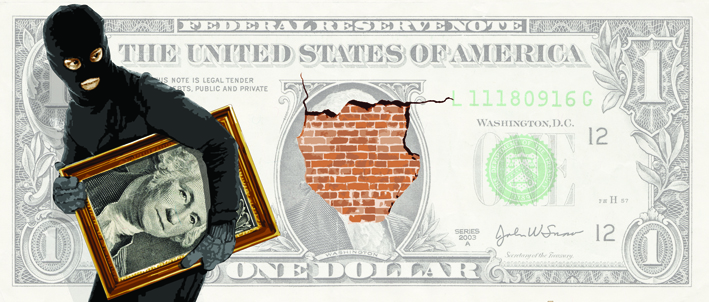
This screenshot has width=709, height=302. I want to click on frame, so click(x=155, y=273).